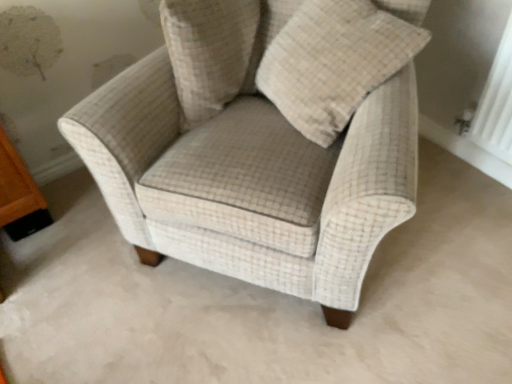
Question: Is beige checkered armchair at center outside beige checkered pillow at upper center?

Choices:
 (A) no
 (B) yes

Answer: (B)

Question: Considering the relative sizes of beige checkered armchair at center and beige checkered pillow at upper center in the image provided, is beige checkered armchair at center taller than beige checkered pillow at upper center?

Choices:
 (A) no
 (B) yes

Answer: (B)

Question: Is beige checkered armchair at center oriented away from beige checkered pillow at upper center?

Choices:
 (A) yes
 (B) no

Answer: (A)

Question: Does beige checkered armchair at center have a lesser height compared to beige checkered pillow at upper center?

Choices:
 (A) yes
 (B) no

Answer: (B)

Question: Is beige checkered armchair at center behind beige checkered pillow at upper center?

Choices:
 (A) yes
 (B) no

Answer: (B)

Question: In the image, is beige checkered pillow at upper center on the left side or the right side of beige checkered armchair at center?

Choices:
 (A) left
 (B) right

Answer: (A)

Question: Is point coord(241,79) positioned closer to the camera than point coord(313,254)?

Choices:
 (A) farther
 (B) closer

Answer: (A)

Question: Is beige checkered pillow at upper center taller or shorter than beige checkered armchair at center?

Choices:
 (A) tall
 (B) short

Answer: (B)

Question: Considering the positions of beige checkered pillow at upper center and beige checkered armchair at center in the image, is beige checkered pillow at upper center wider or thinner than beige checkered armchair at center?

Choices:
 (A) thin
 (B) wide

Answer: (A)

Question: Visually, is beige checkered pillow at upper center positioned to the left or to the right of beige checkered pillow at center?

Choices:
 (A) left
 (B) right

Answer: (A)

Question: From the image's perspective, is beige checkered pillow at upper center located above or below beige checkered pillow at center?

Choices:
 (A) below
 (B) above

Answer: (B)

Question: Considering the positions of point (182, 54) and point (278, 99), is point (182, 54) closer or farther from the camera than point (278, 99)?

Choices:
 (A) closer
 (B) farther

Answer: (A)

Question: From a real-world perspective, is beige checkered pillow at upper center positioned above or below beige checkered pillow at center?

Choices:
 (A) below
 (B) above

Answer: (A)

Question: From the image's perspective, is beige checkered pillow at center located above or below beige checkered armchair at center?

Choices:
 (A) above
 (B) below

Answer: (A)

Question: From a real-world perspective, is beige checkered pillow at center physically located above or below beige checkered armchair at center?

Choices:
 (A) below
 (B) above

Answer: (B)